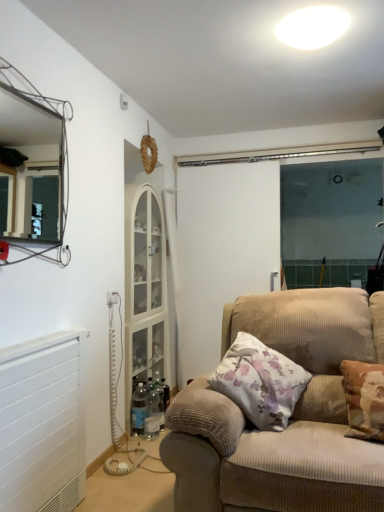
Question: Are white plastic electric outlet at lower left and white glossy ceiling light at upper center located far from each other?

Choices:
 (A) yes
 (B) no

Answer: (A)

Question: Considering the relative sizes of white plastic electric outlet at lower left and white glossy ceiling light at upper center in the image provided, is white plastic electric outlet at lower left bigger than white glossy ceiling light at upper center?

Choices:
 (A) no
 (B) yes

Answer: (A)

Question: Is white plastic electric outlet at lower left looking in the opposite direction of white glossy ceiling light at upper center?

Choices:
 (A) yes
 (B) no

Answer: (B)

Question: Can you confirm if white plastic electric outlet at lower left is positioned to the right of white glossy ceiling light at upper center?

Choices:
 (A) no
 (B) yes

Answer: (A)

Question: Can you confirm if white plastic electric outlet at lower left is shorter than white glossy ceiling light at upper center?

Choices:
 (A) yes
 (B) no

Answer: (B)

Question: In terms of width, does metallic wire frame mirror at upper left look wider or thinner when compared to white glossy ceiling light at upper center?

Choices:
 (A) thin
 (B) wide

Answer: (A)

Question: Considering their positions, is metallic wire frame mirror at upper left located in front of or behind white glossy ceiling light at upper center?

Choices:
 (A) behind
 (B) front

Answer: (B)

Question: From a real-world perspective, relative to white glossy ceiling light at upper center, is metallic wire frame mirror at upper left vertically above or below?

Choices:
 (A) above
 (B) below

Answer: (B)

Question: Is metallic wire frame mirror at upper left inside or outside of white glossy ceiling light at upper center?

Choices:
 (A) inside
 (B) outside

Answer: (B)

Question: From the image's perspective, is beige corduroy couch at center above or below white glossy ceiling light at upper center?

Choices:
 (A) below
 (B) above

Answer: (A)

Question: From a real-world perspective, is beige corduroy couch at center positioned above or below white glossy ceiling light at upper center?

Choices:
 (A) above
 (B) below

Answer: (B)

Question: Based on their positions, is beige corduroy couch at center located to the left or right of white glossy ceiling light at upper center?

Choices:
 (A) right
 (B) left

Answer: (B)

Question: Is point (375, 461) positioned closer to the camera than point (322, 41)?

Choices:
 (A) farther
 (B) closer

Answer: (B)

Question: From the image's perspective, relative to white glossy ceiling light at upper center, is white plastic electric outlet at lower left above or below?

Choices:
 (A) above
 (B) below

Answer: (B)

Question: Considering the positions of white plastic electric outlet at lower left and white glossy ceiling light at upper center in the image, is white plastic electric outlet at lower left taller or shorter than white glossy ceiling light at upper center?

Choices:
 (A) tall
 (B) short

Answer: (A)